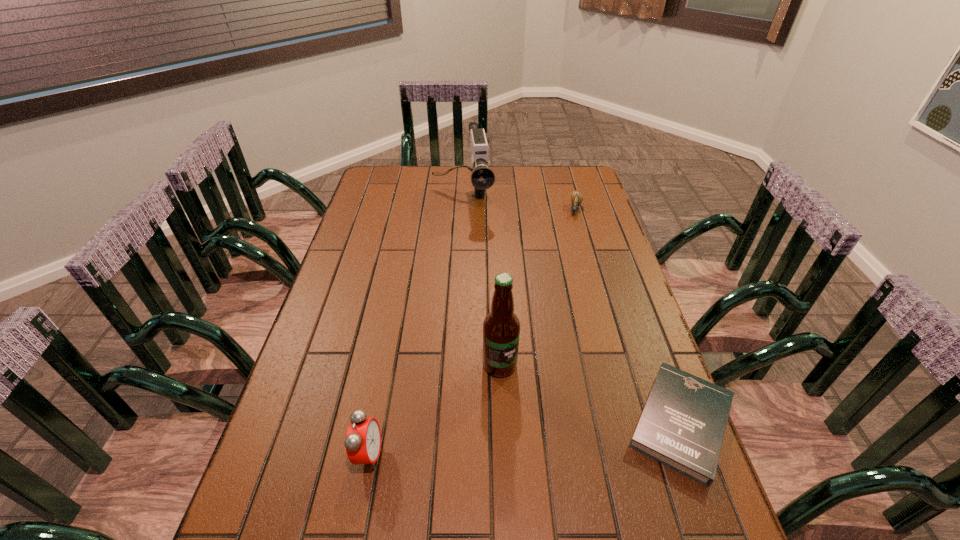
I want to click on free space between the escargot and the third tallest object, so click(x=472, y=332).

Locate an element on the screen. The width and height of the screenshot is (960, 540). empty location between the tallest object and the alarm clock is located at coordinates (434, 410).

Image resolution: width=960 pixels, height=540 pixels. I want to click on vacant area that lies between the shortest object and the leftmost object, so click(x=525, y=438).

You are a GUI agent. You are given a task and a screenshot of the screen. Output one action in this format:
    pyautogui.click(x=<x>, y=<y>)
    Task: Click on the free spot between the fourth tallest object and the alarm clock
    The height and width of the screenshot is (540, 960).
    Given the screenshot: What is the action you would take?
    pyautogui.click(x=472, y=332)

You are a GUI agent. You are given a task and a screenshot of the screen. Output one action in this format:
    pyautogui.click(x=<x>, y=<y>)
    Task: Click on the vacant space in between the fourth shortest object and the leftmost object
    The image size is (960, 540).
    Given the screenshot: What is the action you would take?
    pyautogui.click(x=416, y=326)

This screenshot has width=960, height=540. I want to click on unoccupied position between the camcorder and the leftmost object, so click(x=416, y=326).

This screenshot has width=960, height=540. I want to click on free spot between the tallest object and the fourth tallest object, so click(x=538, y=287).

Locate an element on the screen. vacant point located between the beer bottle and the leftmost object is located at coordinates (434, 410).

This screenshot has height=540, width=960. Find the location of `free space between the beer bottle and the camcorder`. free space between the beer bottle and the camcorder is located at coordinates (481, 281).

Find the location of a particular element. object that can be found as the second closest to the book is located at coordinates (363, 439).